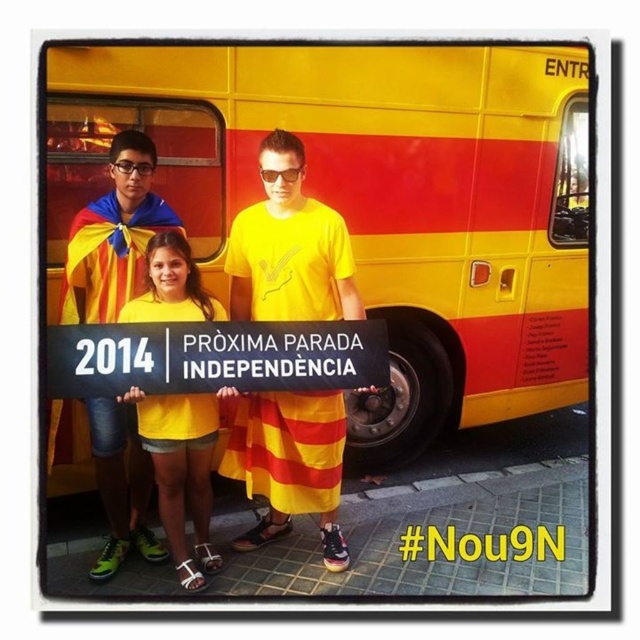
Question: Which object is positioned farthest from the yellow matte bus at center?

Choices:
 (A) yellow matte/yellow t-shirt at center
 (B) yellow matte t-shirt at center

Answer: (A)

Question: Which is nearer to the yellow matte bus at center?

Choices:
 (A) yellow matte/yellow t-shirt at center
 (B) yellow matte shirt at center

Answer: (B)

Question: Can you confirm if yellow matte t-shirt at center is smaller than yellow matte shirt at center?

Choices:
 (A) no
 (B) yes

Answer: (A)

Question: Which of the following is the closest to the observer?

Choices:
 (A) (289, 86)
 (B) (140, 260)
 (C) (166, 492)
 (D) (228, 442)

Answer: (C)

Question: Does yellow matte t-shirt at center lie behind yellow matte shirt at center?

Choices:
 (A) yes
 (B) no

Answer: (B)

Question: Is the position of yellow matte shirt at center less distant than that of yellow matte/yellow t-shirt at center?

Choices:
 (A) no
 (B) yes

Answer: (A)